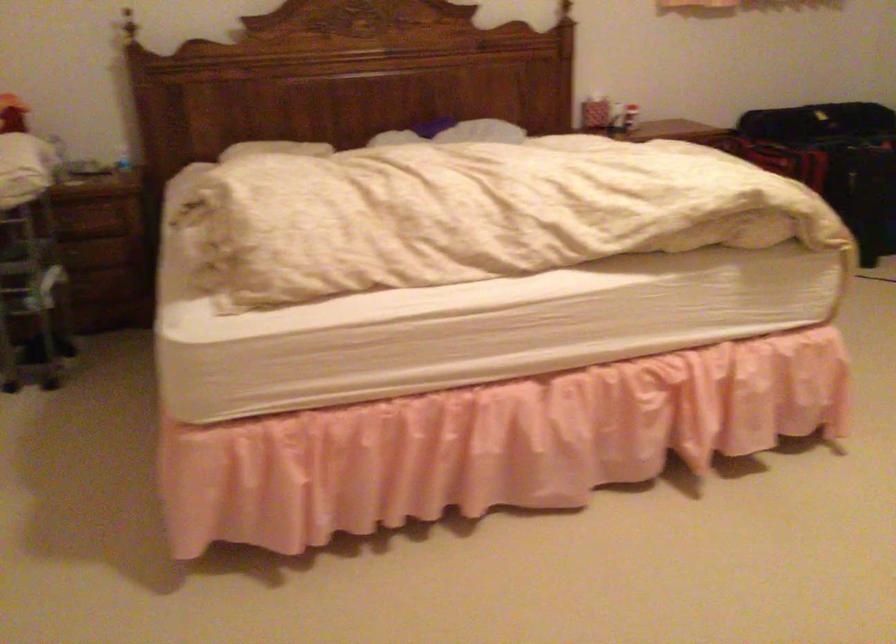
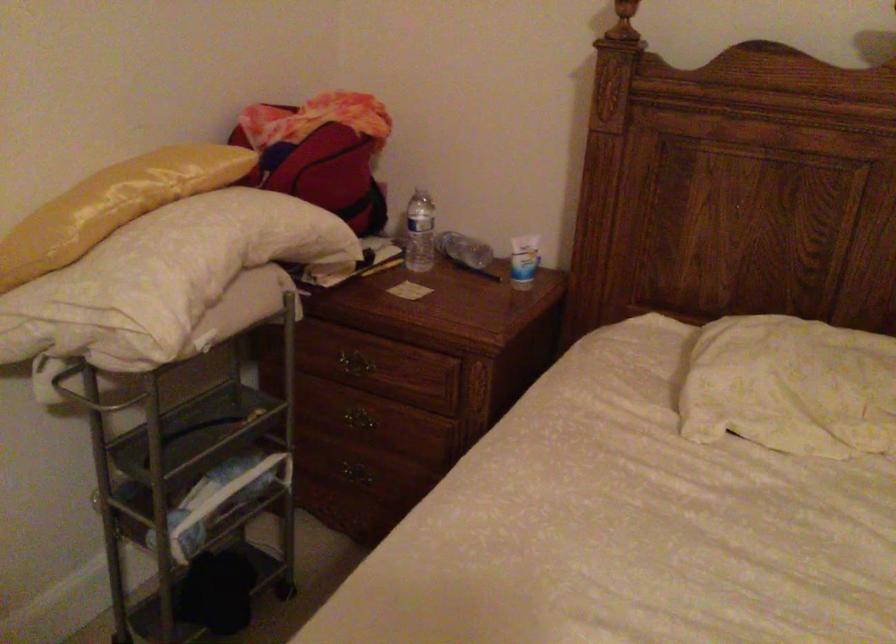
Locate, in the second image, the point that corresponds to point 72,250 in the first image.

(357, 426)